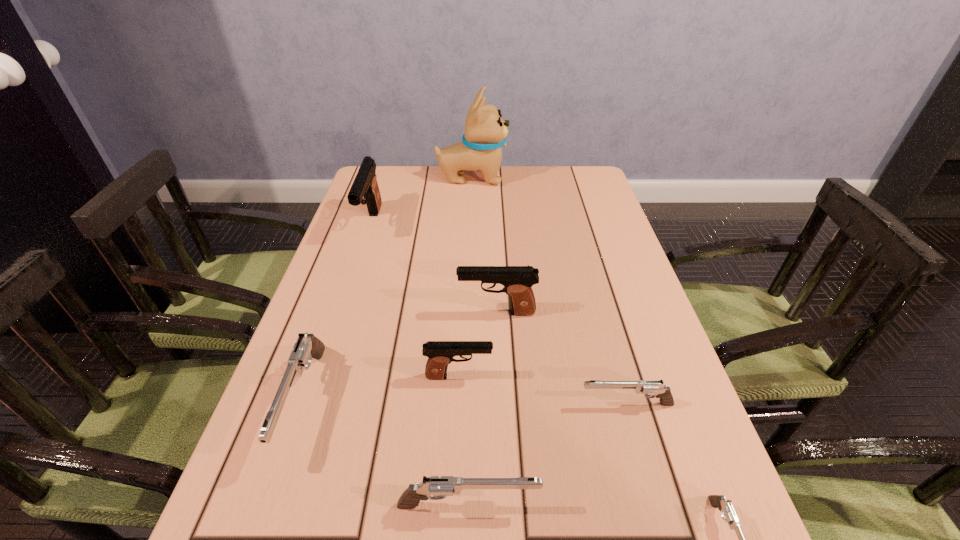
Find the location of a particular element. This screenshot has height=540, width=960. the farthest object is located at coordinates (485, 132).

Identify the location of beige puppy. (485, 132).

The height and width of the screenshot is (540, 960). Find the location of `the second tallest object`. the second tallest object is located at coordinates (365, 190).

Where is `the second farthest object`? the second farthest object is located at coordinates (365, 190).

You are a GUI agent. You are given a task and a screenshot of the screen. Output one action in this format:
    pyautogui.click(x=<x>, y=<y>)
    Task: Click on the sixth shortest pistol
    
    Given the screenshot: What is the action you would take?
    pyautogui.click(x=517, y=280)

Locate an element on the screen. This screenshot has width=960, height=540. the sixth nearest object is located at coordinates (517, 280).

Locate an element on the screen. the leftmost silver pistol is located at coordinates (307, 346).

The height and width of the screenshot is (540, 960). What are the coordinates of `the smallest black pistol` in the screenshot? It's located at (440, 353).

Locate an element on the screen. the third shortest pistol is located at coordinates point(435,487).

Identify the location of the third shortest object. The width and height of the screenshot is (960, 540). (435, 487).